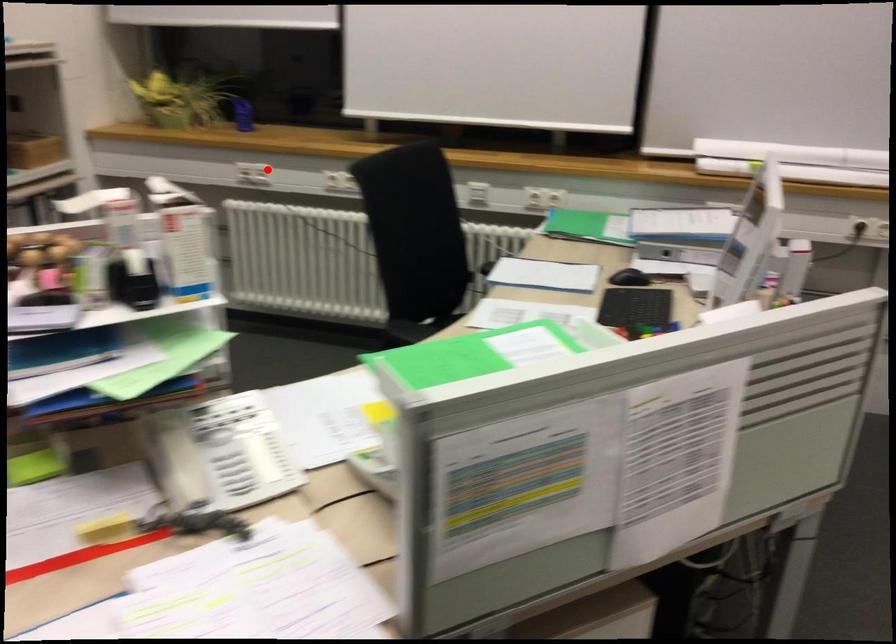
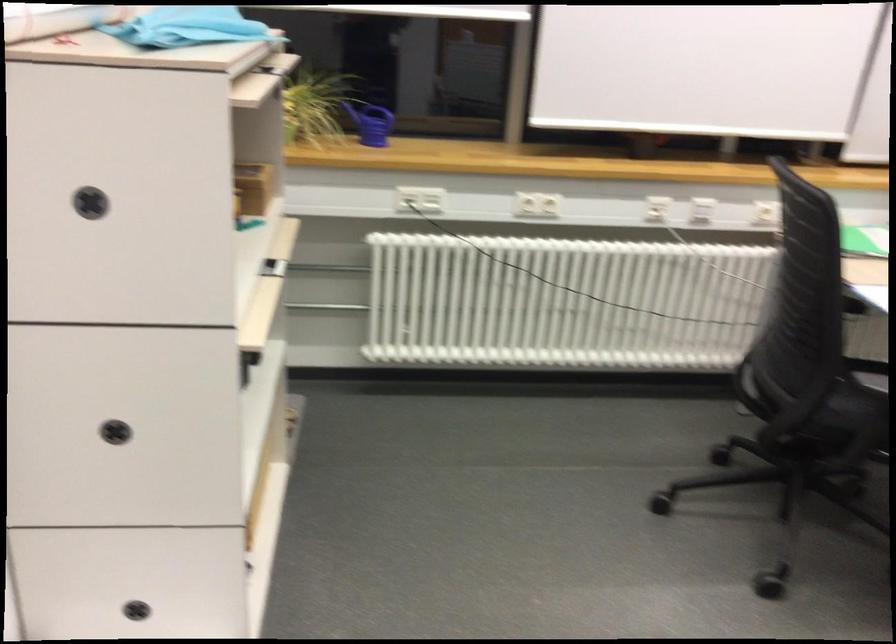
Find the pixel in the second image that matches the highlighted location in the first image.

(419, 199)